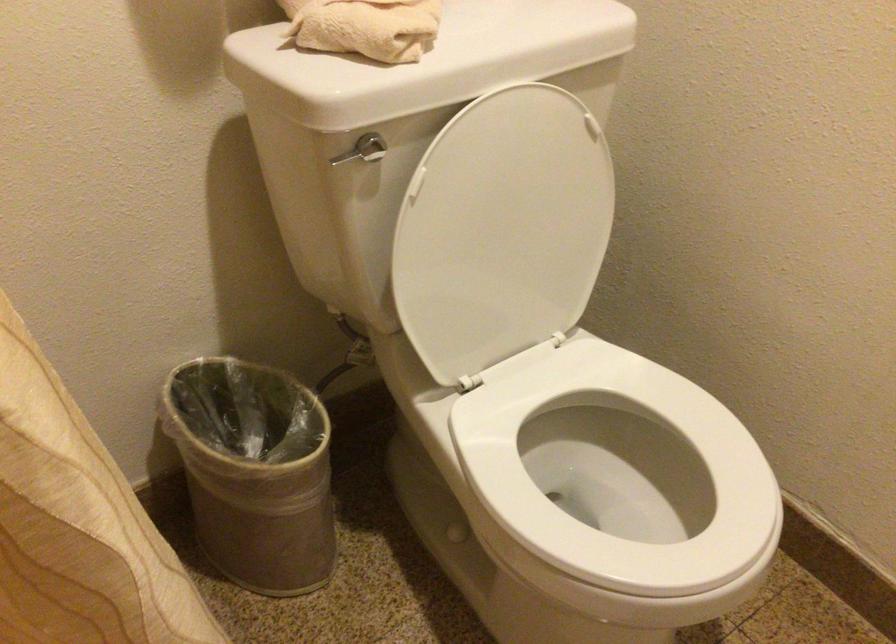
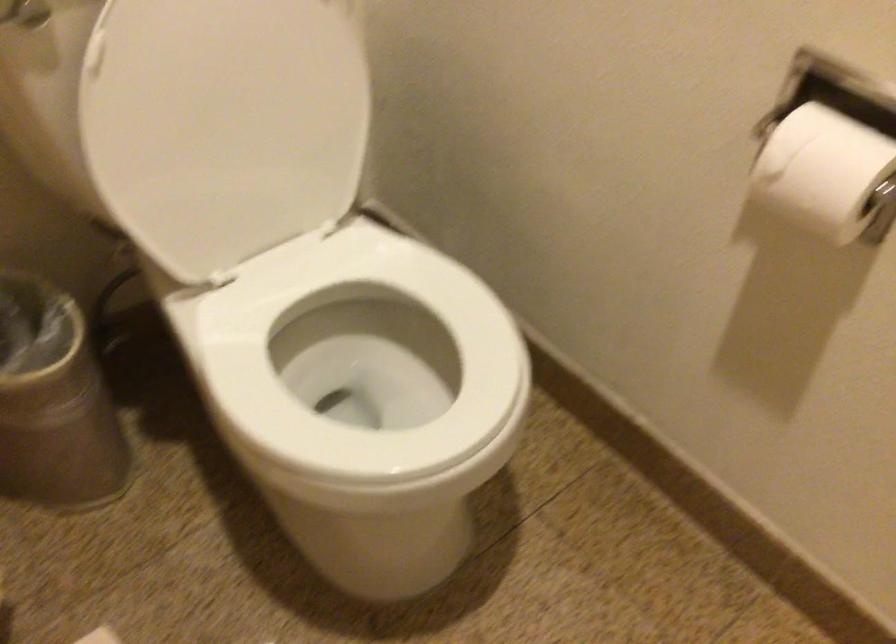
Question: Which direction would the cameraman need to move to produce the second image? Reply with the corresponding letter.

Choices:
 (A) Left
 (B) Right
 (C) Forward
 (D) Backward

Answer: (B)